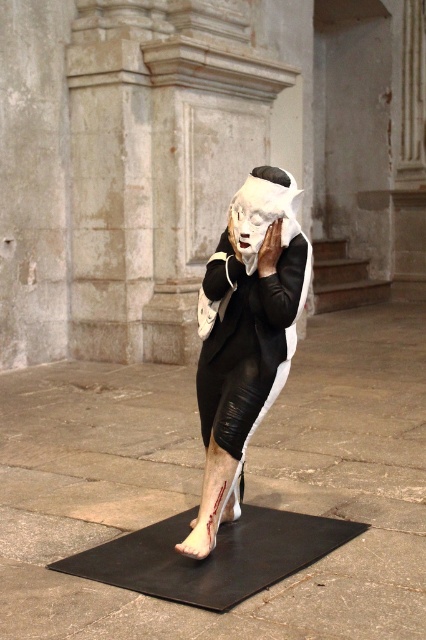
Question: Does black leather robe at center have a larger size compared to white matte mask at center?

Choices:
 (A) yes
 (B) no

Answer: (A)

Question: Which point is farther from the camera taking this photo?

Choices:
 (A) (236, 260)
 (B) (241, 432)

Answer: (A)

Question: Is black leather robe at center positioned before white matte mask at center?

Choices:
 (A) yes
 (B) no

Answer: (A)

Question: Which is nearer to the matte black dress at center?

Choices:
 (A) black leather robe at center
 (B) white matte mask at center

Answer: (A)

Question: Is matte black dress at center above black leather robe at center?

Choices:
 (A) no
 (B) yes

Answer: (A)

Question: Among these points, which one is nearest to the camera?

Choices:
 (A) (232, 243)
 (B) (233, 452)
 (C) (192, 557)

Answer: (C)